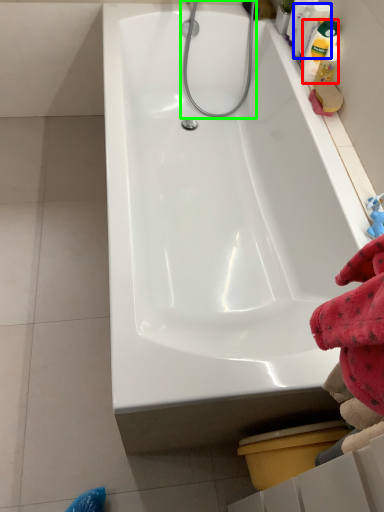
Question: Which object is positioned closest to cleaning product (highlighted by a red box)? Select from cleaning product (highlighted by a blue box) and shower (highlighted by a green box).

Choices:
 (A) cleaning product
 (B) shower

Answer: (A)